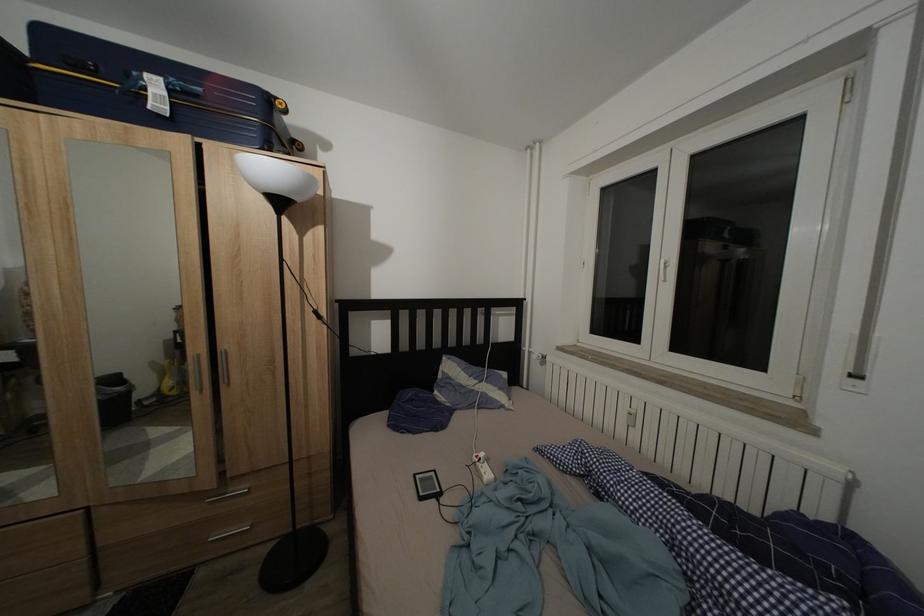
Where would you pull the cabinet door handle? Please return your answer as a coordinate pair (x, y).

(225, 368)